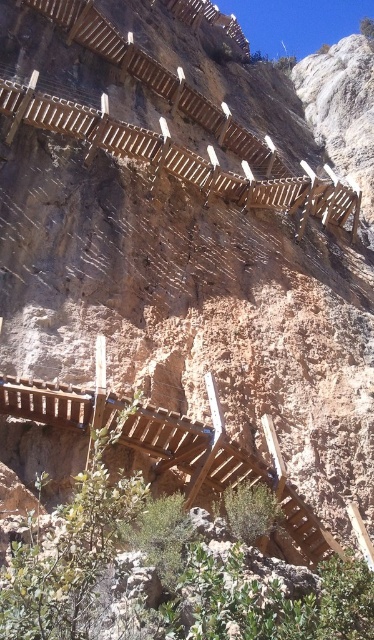
You are standing on the wooden walkway and notice a point marked at coordinates (191, 449). What object is located at that point?

The point at coordinates (191, 449) indicates a brown wooden balustrade at center.

You are a safety inspector evaluating the cliff walkway. You notice two structures on the walkway. One is the brown wooden balustrade at center and the other is the wooden at upper center. Which structure is taller?

The wooden at upper center is taller than the brown wooden balustrade at center.

You are standing on the wooden walkway and looking towards the cliff face. Which object is closer to you between the brown wooden balustrade at center and the wooden at upper center?

The brown wooden balustrade at center is closer to you because it is in front of the wooden at upper center.